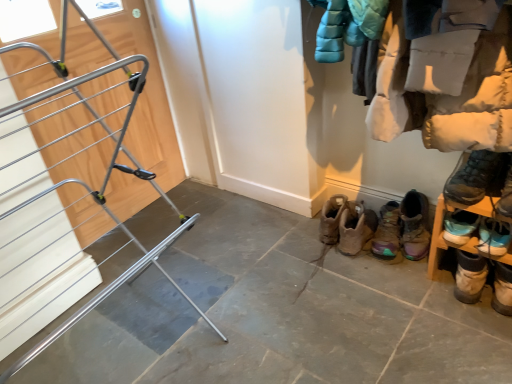
In order to click on free space in front of wooden shoe rack at lower right in this screenshot , I will do `click(473, 332)`.